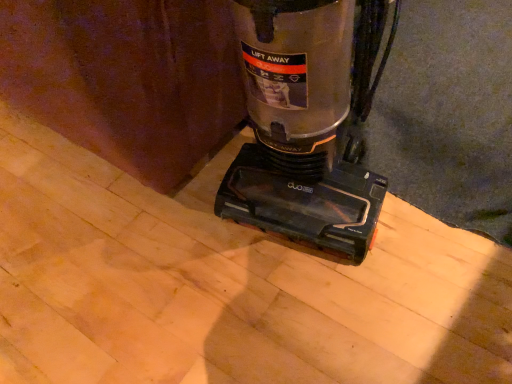
At what (x,y) coordinates should I click in order to perform the action: click on free space to the left of metallic vacuum cleaner at center. Please return your answer as a coordinate pair (x, y). Looking at the image, I should click on (163, 243).